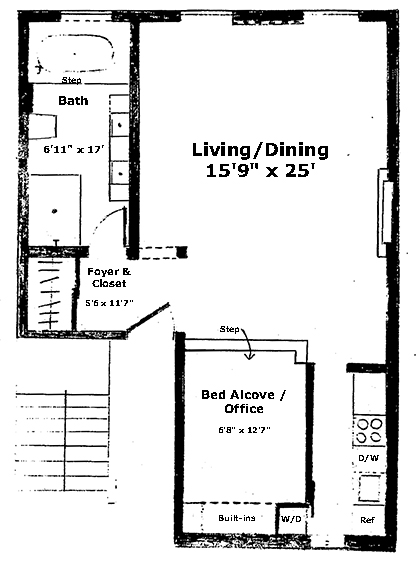
Where is `entry`? The height and width of the screenshot is (562, 420). entry is located at coordinates (345, 22).